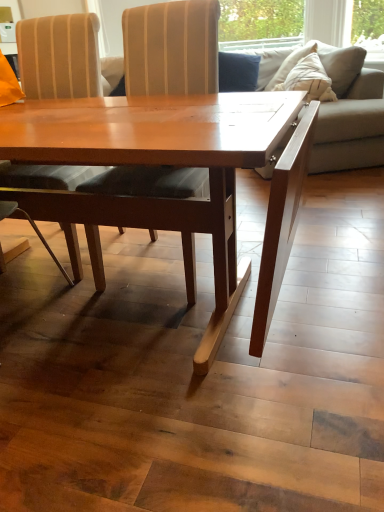
At what (x,y) coordinates should I click in order to perform the action: click on vacant area that is situated to the right of wooden striped chair at center, arranged as the 1th chair when viewed from the right. Please return your answer as a coordinate pair (x, y). Looking at the image, I should click on (304, 271).